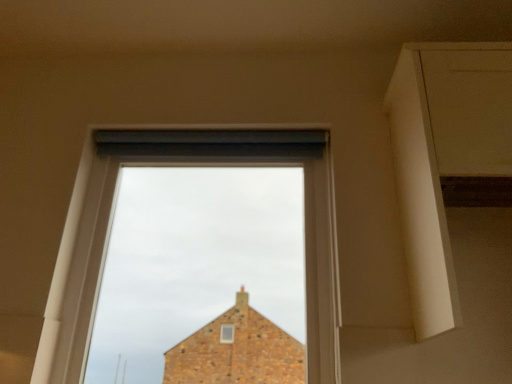
Question: Should I look upward or downward to see matte glass window at center?

Choices:
 (A) up
 (B) down

Answer: (B)